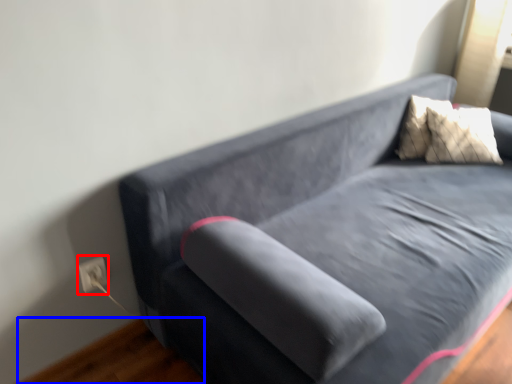
Question: Which of the following is the closest to the observer, electric outlet (highlighted by a red box) or hardwood (highlighted by a blue box)?

Choices:
 (A) electric outlet
 (B) hardwood

Answer: (B)